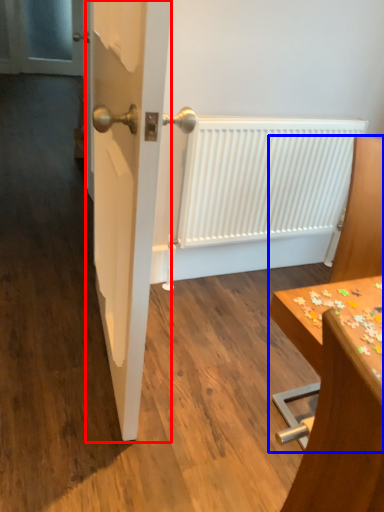
Question: Which point is closer to the camera, door (highlighted by a red box) or furniture (highlighted by a blue box)?

Choices:
 (A) door
 (B) furniture

Answer: (A)